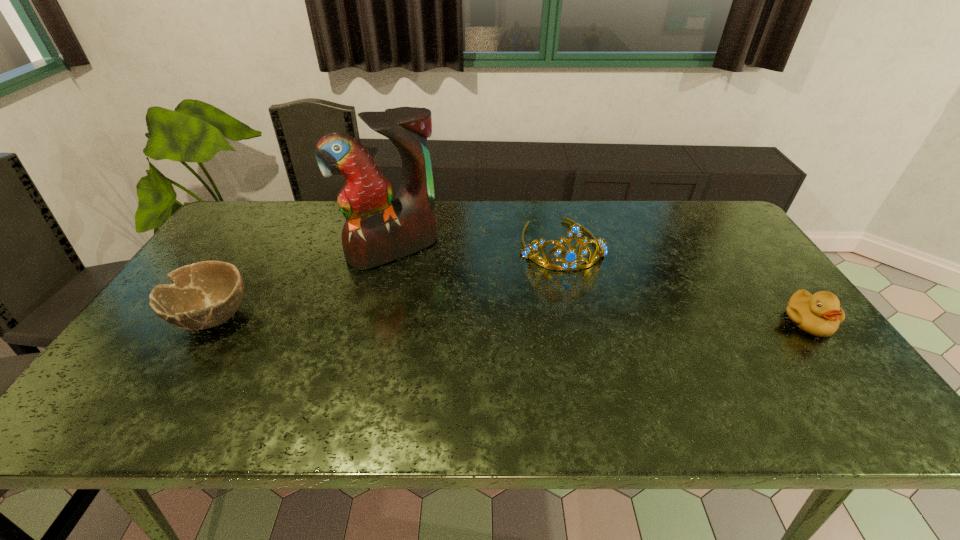
Where is `free spot on the desktop that is between the bowl and the duckling and is positioned on the front-facing side of the third shortest object`? Image resolution: width=960 pixels, height=540 pixels. free spot on the desktop that is between the bowl and the duckling and is positioned on the front-facing side of the third shortest object is located at coordinates (583, 320).

The width and height of the screenshot is (960, 540). Identify the location of vacant space on the desktop that is between the leftmost object and the duckling and is positioned at the face of the parrot. (440, 319).